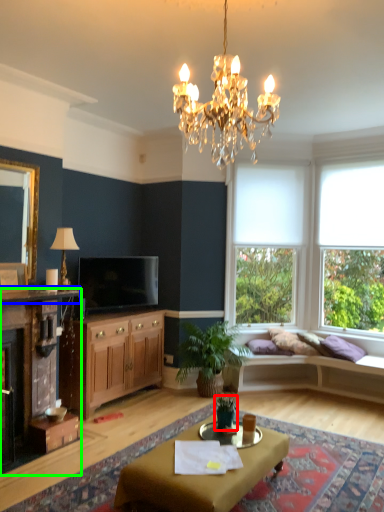
Question: Which object is positioned closest to houseplant (highlighted by a red box)? Select from mantle (highlighted by a blue box) and cabinet (highlighted by a green box).

Choices:
 (A) mantle
 (B) cabinet

Answer: (B)